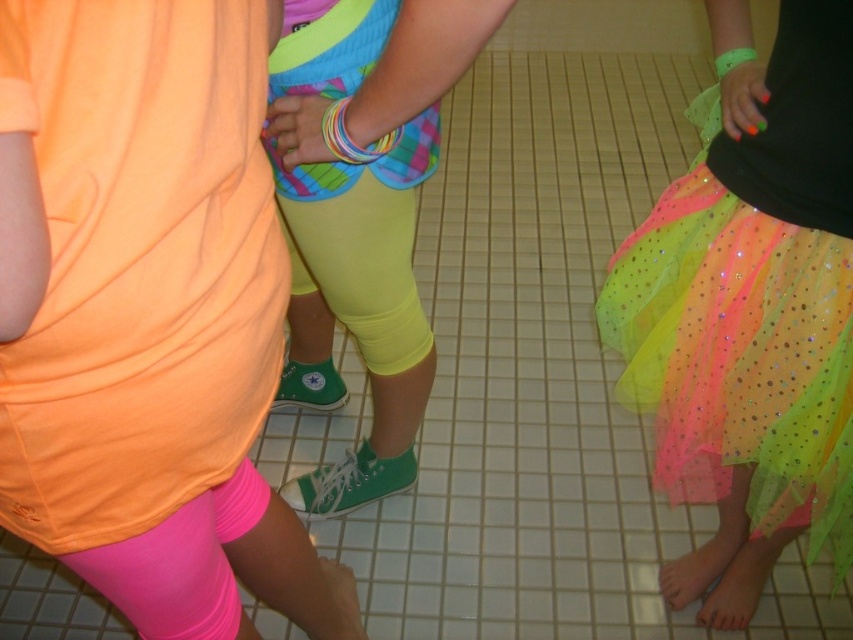
Question: Which point is farther to the camera?

Choices:
 (A) (115, 236)
 (B) (372, 32)
 (C) (772, 420)

Answer: (C)

Question: Which point is farther to the camera?

Choices:
 (A) neon yellow spandex at center
 (B) neon tulle skirt at lower right

Answer: (A)

Question: Is neon sequined tutu at center to the right of neon yellow spandex at center from the viewer's perspective?

Choices:
 (A) yes
 (B) no

Answer: (A)

Question: Is neon tulle skirt at lower right wider than neon sequined tutu at center?

Choices:
 (A) yes
 (B) no

Answer: (B)

Question: Which point is farther from the camera taking this photo?

Choices:
 (A) (711, 296)
 (B) (408, 192)

Answer: (B)

Question: From the image, what is the correct spatial relationship of neon tulle skirt at lower right in relation to neon yellow spandex at center?

Choices:
 (A) above
 (B) below

Answer: (B)